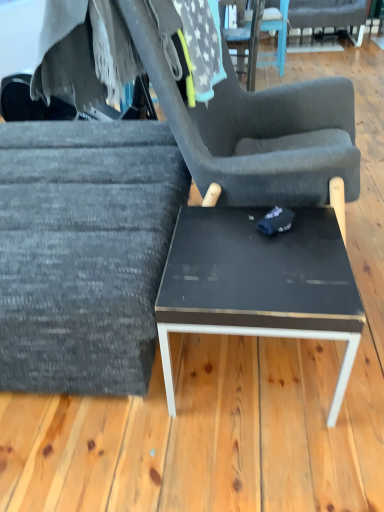
Question: From the image's perspective, does black glossy table at center appear lower than dark gray fabric chair at upper right, the third chair positioned from the bottom?

Choices:
 (A) yes
 (B) no

Answer: (A)

Question: Is black glossy table at center touching dark gray fabric chair at upper right, marked as the first chair in a right-to-left arrangement?

Choices:
 (A) no
 (B) yes

Answer: (A)

Question: Is the position of black glossy table at center more distant than that of dark gray fabric chair at upper right, the third chair positioned from the bottom?

Choices:
 (A) no
 (B) yes

Answer: (A)

Question: Does black glossy table at center lie in front of dark gray fabric chair at upper right, marked as the first chair in a right-to-left arrangement?

Choices:
 (A) no
 (B) yes

Answer: (B)

Question: Does black glossy table at center have a greater height compared to dark gray fabric chair at upper right, marked as the first chair in a right-to-left arrangement?

Choices:
 (A) yes
 (B) no

Answer: (B)

Question: Could you tell me if black glossy table at center is facing dark gray fabric chair at upper right, the third chair positioned from the bottom?

Choices:
 (A) no
 (B) yes

Answer: (B)

Question: From a real-world perspective, is textured gray fabric chair at left, which ranks as the first chair in left-to-right order, beneath textured gray fabric chair at center, acting as the 2th chair starting from the top?

Choices:
 (A) no
 (B) yes

Answer: (B)

Question: From the image's perspective, is textured gray fabric chair at left, which is counted as the third chair, starting from the back, located beneath textured gray fabric chair at center, acting as the 2th chair starting from the top?

Choices:
 (A) yes
 (B) no

Answer: (A)

Question: Does textured gray fabric chair at left, which ranks as the first chair in left-to-right order, have a greater width compared to textured gray fabric chair at center, positioned as the 2th chair in back-to-front order?

Choices:
 (A) no
 (B) yes

Answer: (B)

Question: Is textured gray fabric chair at left, which is counted as the third chair, starting from the back, shorter than textured gray fabric chair at center, the second chair from the bottom?

Choices:
 (A) yes
 (B) no

Answer: (A)

Question: Could you tell me if textured gray fabric chair at left, the third chair positioned from the top, is facing textured gray fabric chair at center, acting as the 2th chair starting from the top?

Choices:
 (A) yes
 (B) no

Answer: (A)

Question: Is the position of textured gray fabric chair at left, the third chair positioned from the top, less distant than that of textured gray fabric chair at center, the second chair when ordered from right to left?

Choices:
 (A) no
 (B) yes

Answer: (B)

Question: Are textured gray fabric chair at left, the third chair positioned from the top, and fuzzy gray blanket at upper left making contact?

Choices:
 (A) yes
 (B) no

Answer: (B)